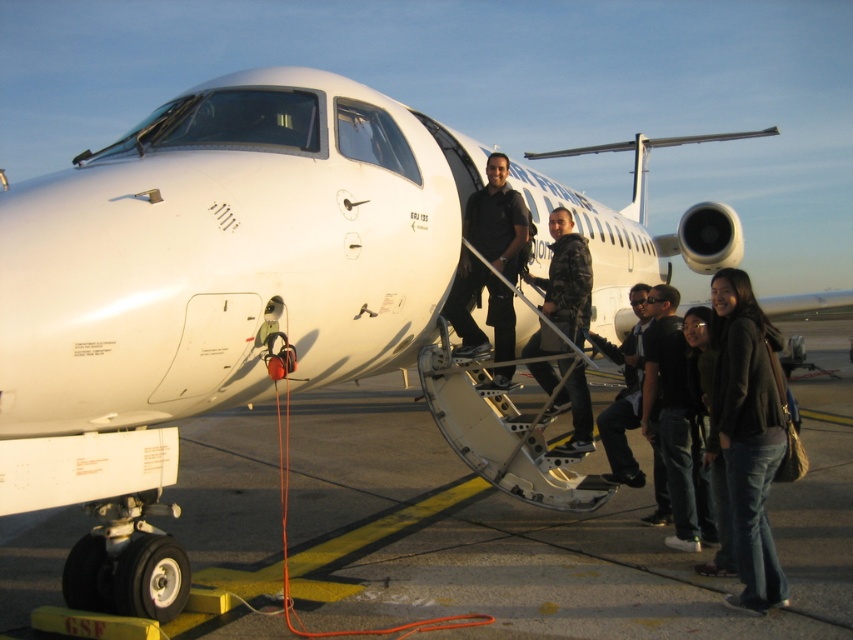
Question: Which is nearer to the camouflage jacket at center?

Choices:
 (A) black matte uniform at center
 (B) dark gray sweater at lower right
 (C) dark blue jeans at center

Answer: (A)

Question: Is black matte uniform at center closer to camera compared to camouflage jacket at center?

Choices:
 (A) yes
 (B) no

Answer: (B)

Question: Does black matte uniform at center have a lesser width compared to camouflage jacket at center?

Choices:
 (A) no
 (B) yes

Answer: (A)

Question: Which point is closer to the camera?

Choices:
 (A) black matte uniform at center
 (B) dark blue jeans at center
 (C) camouflage jacket at center
 (D) dark gray sweater at lower right

Answer: (D)

Question: Which object is positioned farthest from the dark gray sweater at lower right?

Choices:
 (A) camouflage jacket at center
 (B) dark blue jeans at center
 (C) black matte uniform at center

Answer: (C)

Question: Considering the relative positions of dark gray sweater at lower right and dark blue jeans at center in the image provided, where is dark gray sweater at lower right located with respect to dark blue jeans at center?

Choices:
 (A) below
 (B) above

Answer: (A)